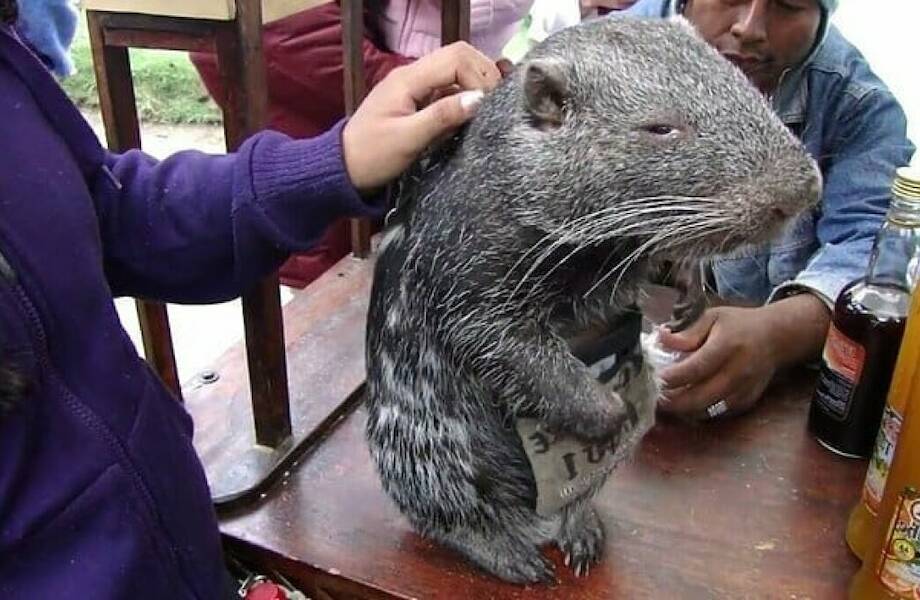
The height and width of the screenshot is (600, 920). Identify the location of very scratched wooden table. (318, 524), (426, 583), (680, 585), (822, 527), (676, 472), (776, 434), (335, 441), (224, 414), (318, 350), (349, 285).